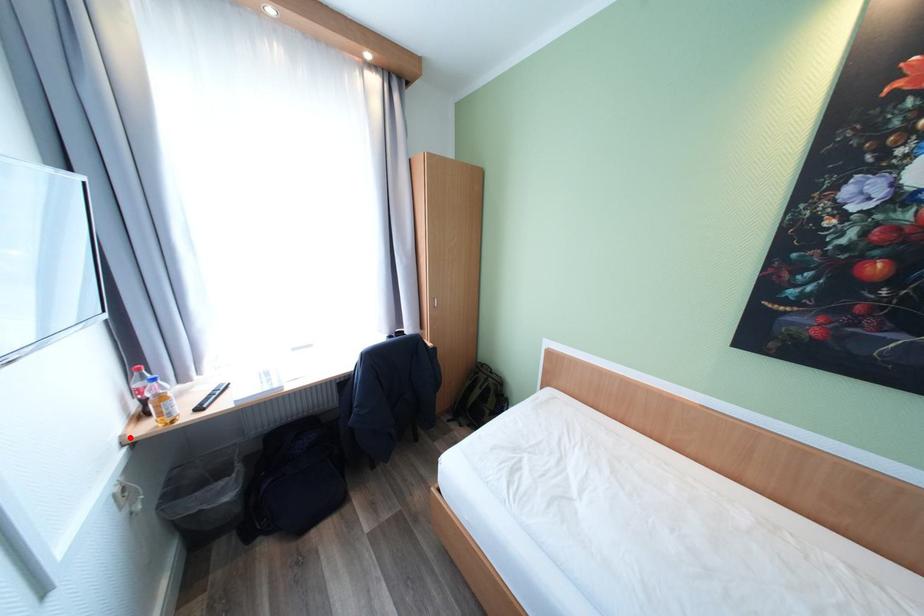
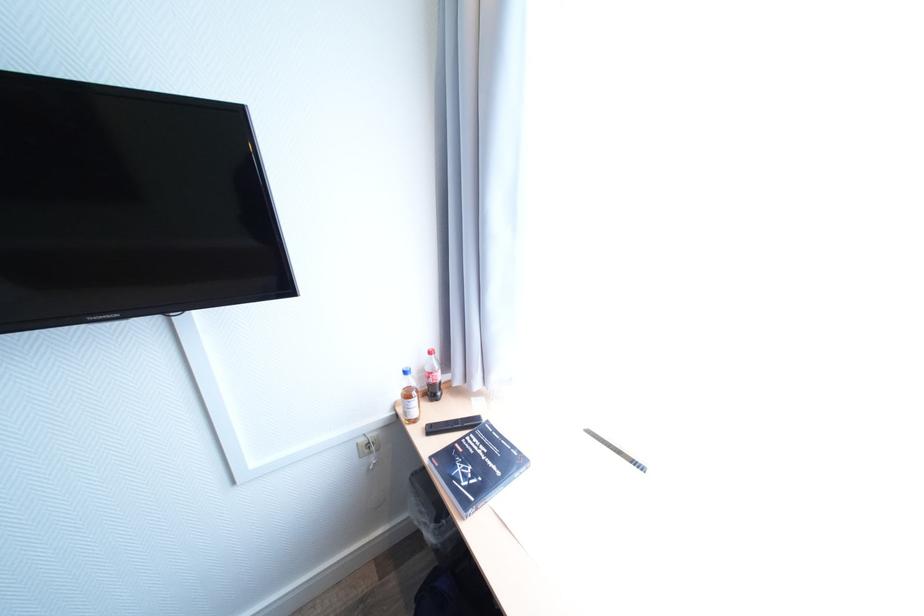
Question: I am providing you with two images of the same scene from different viewpoints. A red point is shown in image1. For the corresponding object point in image2, is it positioned nearer or farther from the camera?

Choices:
 (A) Nearer
 (B) Farther

Answer: (B)